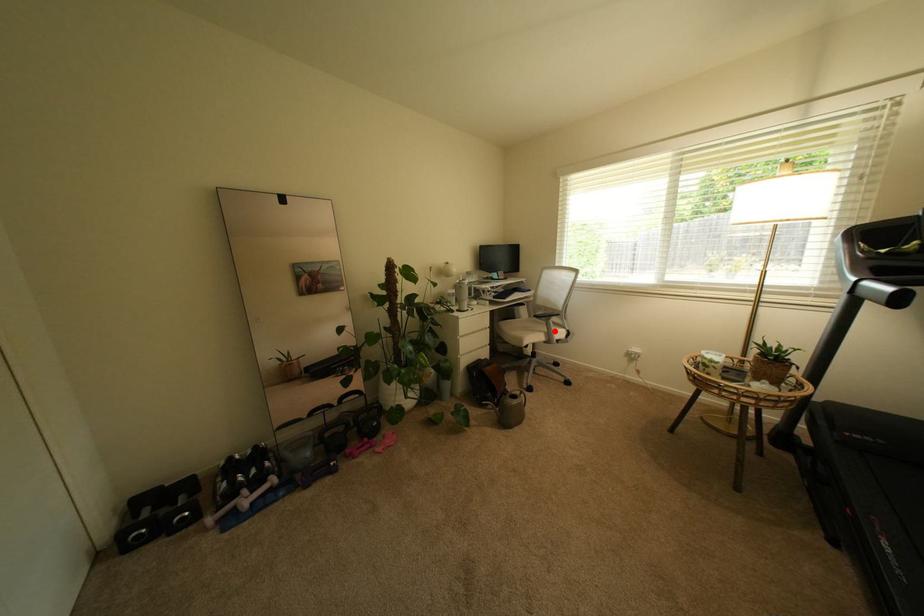
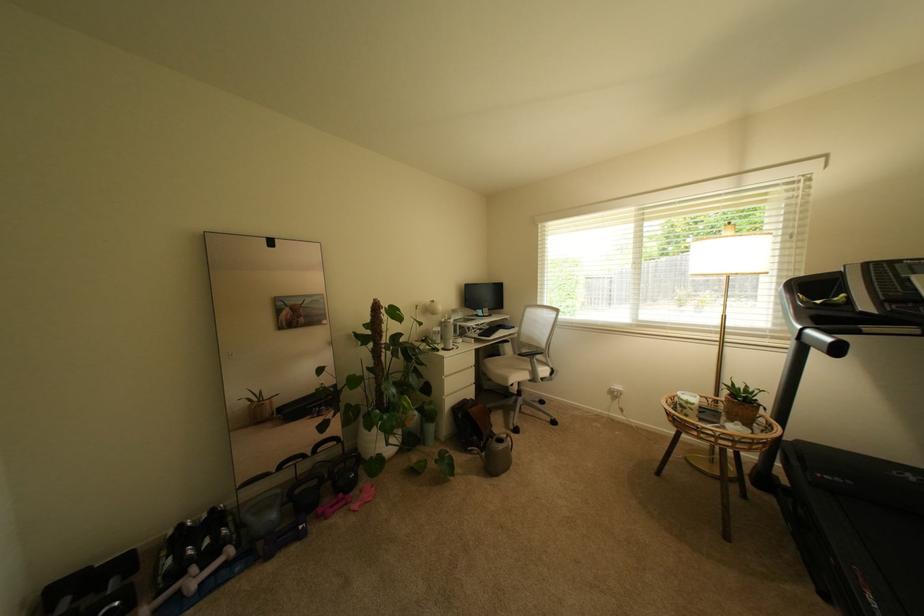
In the second image, find the point that corresponds to the highlighted location in the first image.

(540, 370)